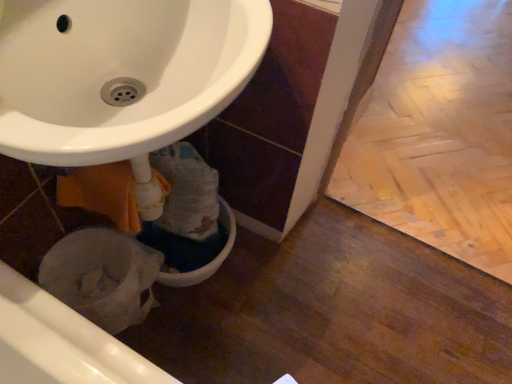
Question: From the image's perspective, would you say white plastic bidet at lower left is shown under wooden parquet floor at lower right?

Choices:
 (A) no
 (B) yes

Answer: (B)

Question: Is white plastic bidet at lower left at the right side of wooden parquet floor at lower right?

Choices:
 (A) yes
 (B) no

Answer: (B)

Question: From a real-world perspective, does white plastic bidet at lower left stand above wooden parquet floor at lower right?

Choices:
 (A) yes
 (B) no

Answer: (A)

Question: From a real-world perspective, is white plastic bidet at lower left below wooden parquet floor at lower right?

Choices:
 (A) no
 (B) yes

Answer: (A)

Question: Is white plastic bidet at lower left to the left of wooden parquet floor at lower right from the viewer's perspective?

Choices:
 (A) no
 (B) yes

Answer: (B)

Question: Is white plastic bidet at lower left bigger than wooden parquet floor at lower right?

Choices:
 (A) no
 (B) yes

Answer: (A)

Question: Is wooden parquet floor at lower right closer to the viewer compared to white plastic bidet at lower left?

Choices:
 (A) no
 (B) yes

Answer: (A)

Question: Does wooden parquet floor at lower right have a lesser width compared to white plastic bidet at lower left?

Choices:
 (A) no
 (B) yes

Answer: (A)

Question: Is wooden parquet floor at lower right far away from white plastic bidet at lower left?

Choices:
 (A) no
 (B) yes

Answer: (B)

Question: Is white plastic bidet at lower left surrounded by wooden parquet floor at lower right?

Choices:
 (A) yes
 (B) no

Answer: (B)

Question: Are wooden parquet floor at lower right and white plastic bidet at lower left beside each other?

Choices:
 (A) yes
 (B) no

Answer: (B)

Question: From the image's perspective, is wooden parquet floor at lower right located beneath white plastic bidet at lower left?

Choices:
 (A) yes
 (B) no

Answer: (B)

Question: Does point (118, 324) appear closer or farther from the camera than point (449, 74)?

Choices:
 (A) closer
 (B) farther

Answer: (A)